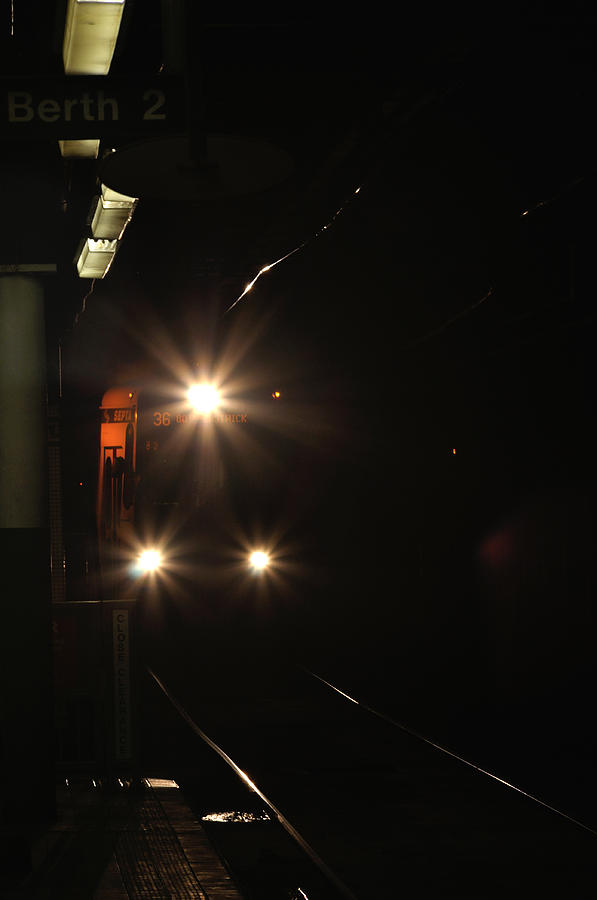
You are a GUI agent. You are given a task and a screenshot of the screen. Output one action in this format:
    pyautogui.click(x=<x>, y=<y>)
    Task: Click on the left light
    This screenshot has height=900, width=597.
    Given the screenshot: What is the action you would take?
    pyautogui.click(x=158, y=565)